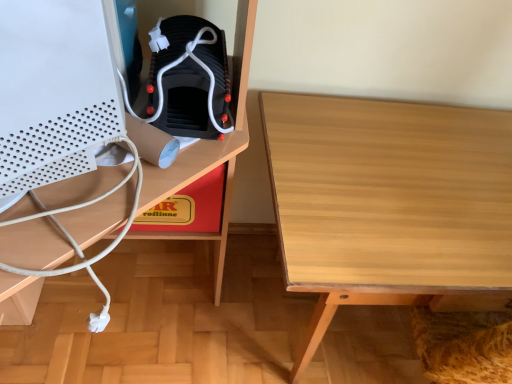
Question: Is light wood table at center not within red cardboard box at center?

Choices:
 (A) yes
 (B) no

Answer: (A)

Question: From the image's perspective, is light wood table at center on top of red cardboard box at center?

Choices:
 (A) no
 (B) yes

Answer: (A)

Question: From a real-world perspective, is light wood table at center located beneath red cardboard box at center?

Choices:
 (A) yes
 (B) no

Answer: (A)

Question: Is red cardboard box at center at the back of light wood table at center?

Choices:
 (A) no
 (B) yes

Answer: (A)

Question: Does light wood table at center come behind red cardboard box at center?

Choices:
 (A) yes
 (B) no

Answer: (B)

Question: From a real-world perspective, is light wood table at center above or below black matte boot at center?

Choices:
 (A) below
 (B) above

Answer: (A)

Question: From the image's perspective, is light wood table at center above or below black matte boot at center?

Choices:
 (A) below
 (B) above

Answer: (A)

Question: Would you say light wood table at center is to the left or to the right of black matte boot at center in the picture?

Choices:
 (A) left
 (B) right

Answer: (B)

Question: Is light wood table at center bigger or smaller than black matte boot at center?

Choices:
 (A) big
 (B) small

Answer: (A)

Question: Is point (225, 170) closer or farther from the camera than point (97, 13)?

Choices:
 (A) farther
 (B) closer

Answer: (A)

Question: Is red cardboard box at center bigger or smaller than white matte desktop computer at left?

Choices:
 (A) big
 (B) small

Answer: (B)

Question: In the image, is red cardboard box at center positioned in front of or behind white matte desktop computer at left?

Choices:
 (A) behind
 (B) front

Answer: (A)

Question: Is red cardboard box at center inside or outside of white matte desktop computer at left?

Choices:
 (A) outside
 (B) inside

Answer: (A)

Question: Based on their sizes in the image, would you say light wood table at center is bigger or smaller than red cardboard box at center?

Choices:
 (A) small
 (B) big

Answer: (B)

Question: Is light wood table at center situated inside red cardboard box at center or outside?

Choices:
 (A) inside
 (B) outside

Answer: (B)